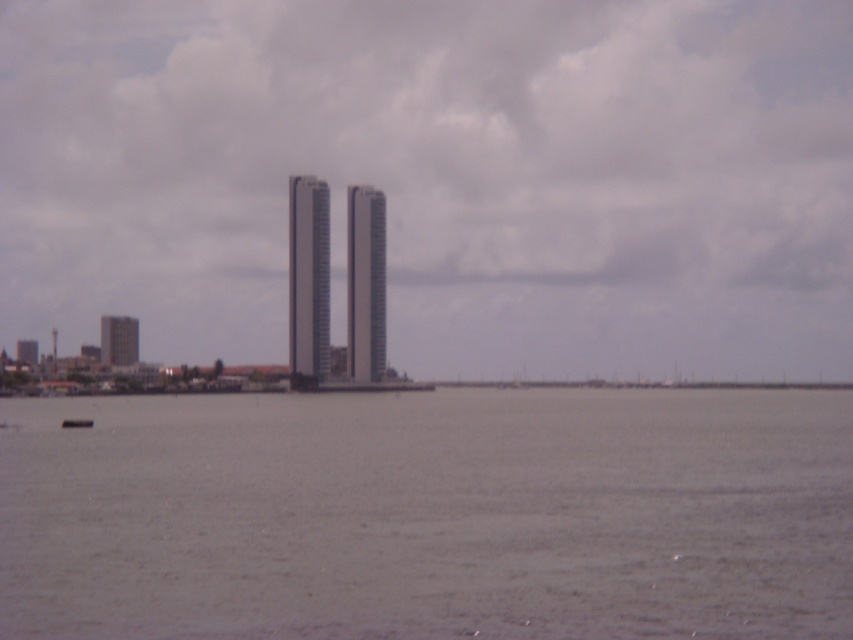
You are a drone operator who needs to deliver a package to the smooth glass tower at center. According to the coordinates provided, where should you aim the drone for precise delivery?

The smooth glass tower at center is located at coordinates point (364, 284), so you should aim the drone at that exact point for precise delivery.

You are a photographer planning to take a photo of the white glass tower at center and the gray matte water at center. Based on their positions, which object should you focus on first if you want to capture both in a single shot without moving the camera?

The gray matte water at center is located below the white glass tower at center, so you should focus on the white glass tower at center first since it is higher up and the water is beneath it, allowing both to be in frame without moving the camera.